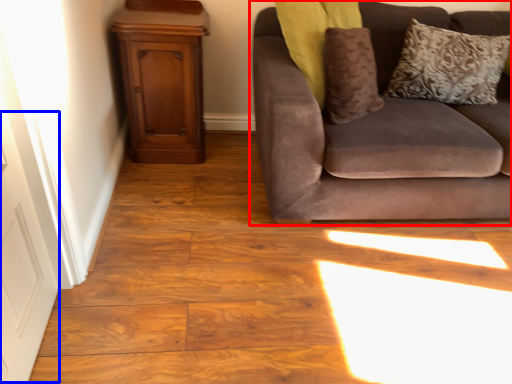
Question: Which object is further to the camera taking this photo, studio couch (highlighted by a red box) or door (highlighted by a blue box)?

Choices:
 (A) studio couch
 (B) door

Answer: (A)